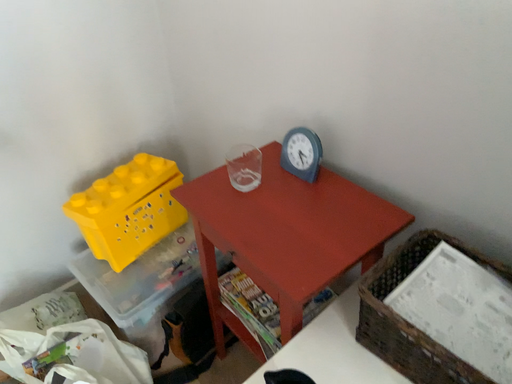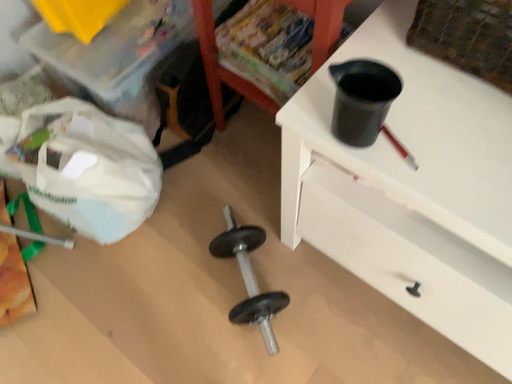
Question: How did the camera likely rotate when shooting the video?

Choices:
 (A) rotated upward
 (B) rotated downward

Answer: (B)